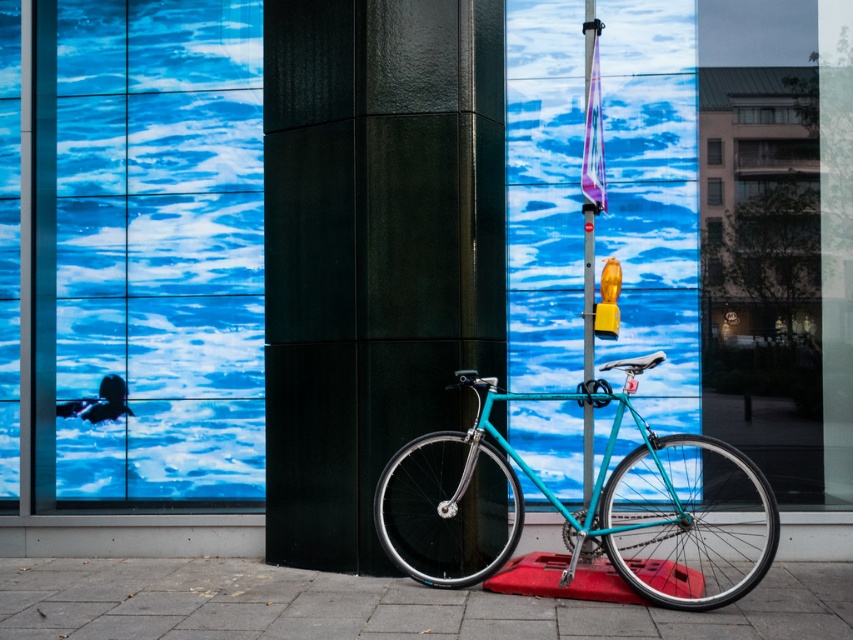
You are standing in front of the large glass window with the abstract water pattern. You see a point marked at coordinates (587, 506). Which object from the scene does this point belong to?

The point at coordinates (587, 506) is on the teal matte bicycle at center.